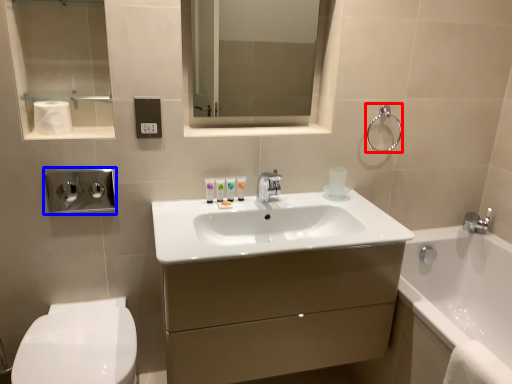
Question: Which of the following is the closest to the observer, towel bar (highlighted by a red box) or dispenser (highlighted by a blue box)?

Choices:
 (A) towel bar
 (B) dispenser

Answer: (B)